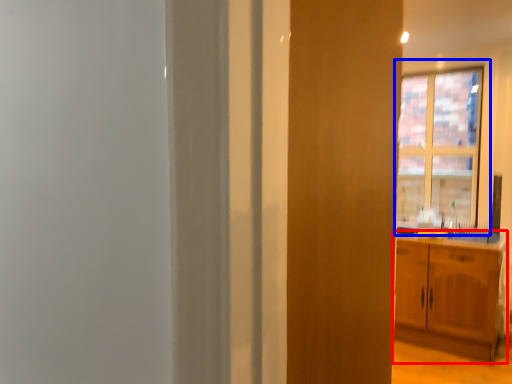
Question: Which of the following is the closest to the observer, cabinetry (highlighted by a red box) or window (highlighted by a blue box)?

Choices:
 (A) cabinetry
 (B) window

Answer: (A)